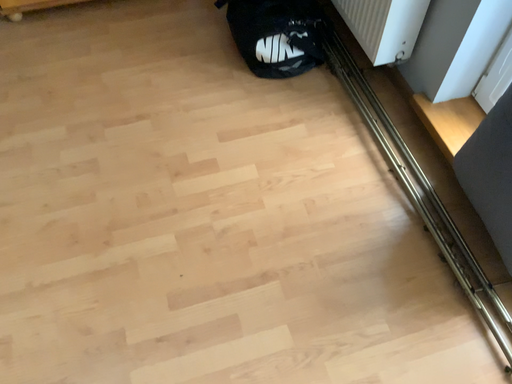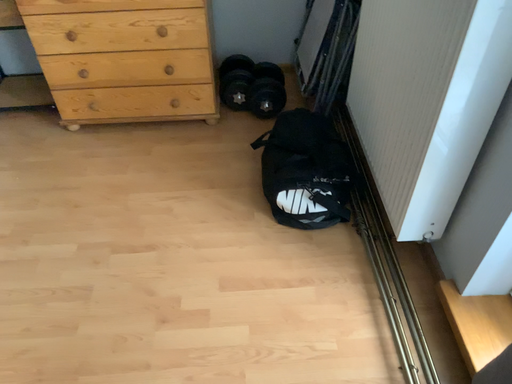
Question: Which way did the camera rotate in the video?

Choices:
 (A) rotated right
 (B) rotated left

Answer: (B)